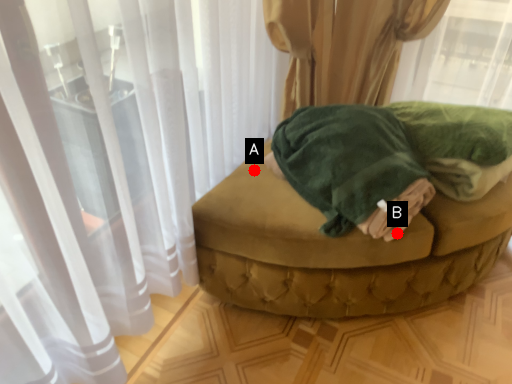
Question: Two points are circled on the image, labeled by A and B beside each circle. Which point is farther to the camera?

Choices:
 (A) A is further
 (B) B is further

Answer: (A)